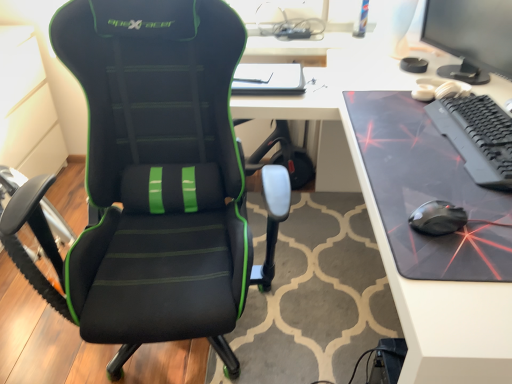
Identify the location of vacant space behind black glossy mouse at right. The width and height of the screenshot is (512, 384). (417, 178).